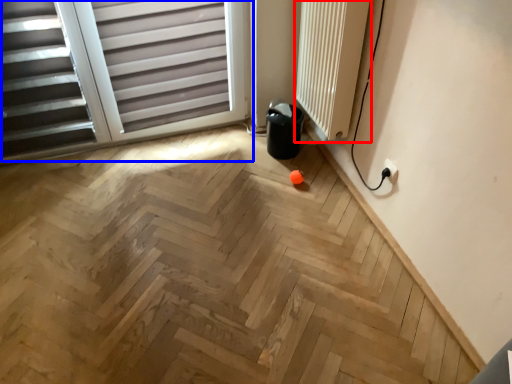
Question: Which point is closer to the camera, radiator (highlighted by a red box) or window (highlighted by a blue box)?

Choices:
 (A) radiator
 (B) window

Answer: (A)